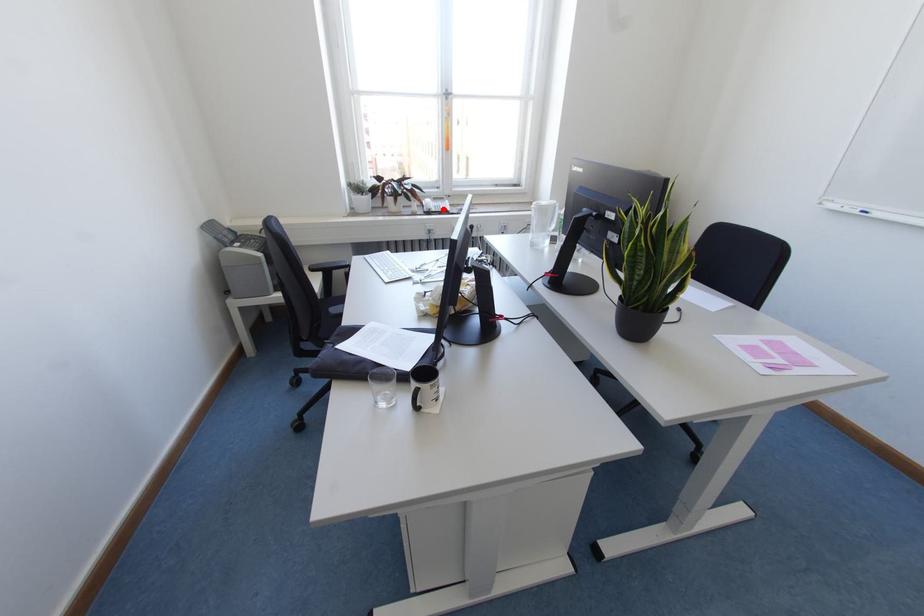
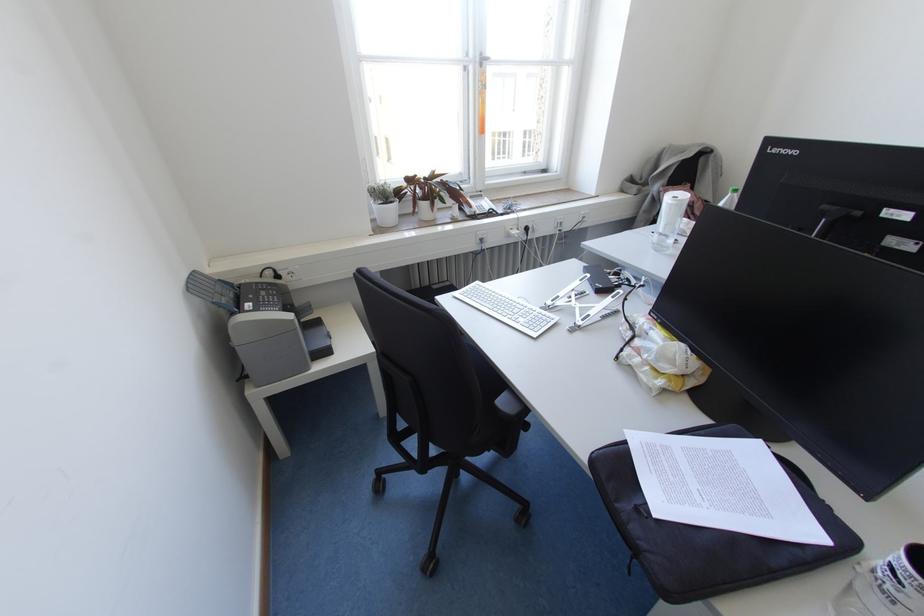
Question: A red point is marked in image1. In image2, is the corresponding 3D point closer to the camera or farther? Reply with the corresponding letter.

Choices:
 (A) The corresponding 3D point is closer.
 (B) The corresponding 3D point is farther.

Answer: (A)